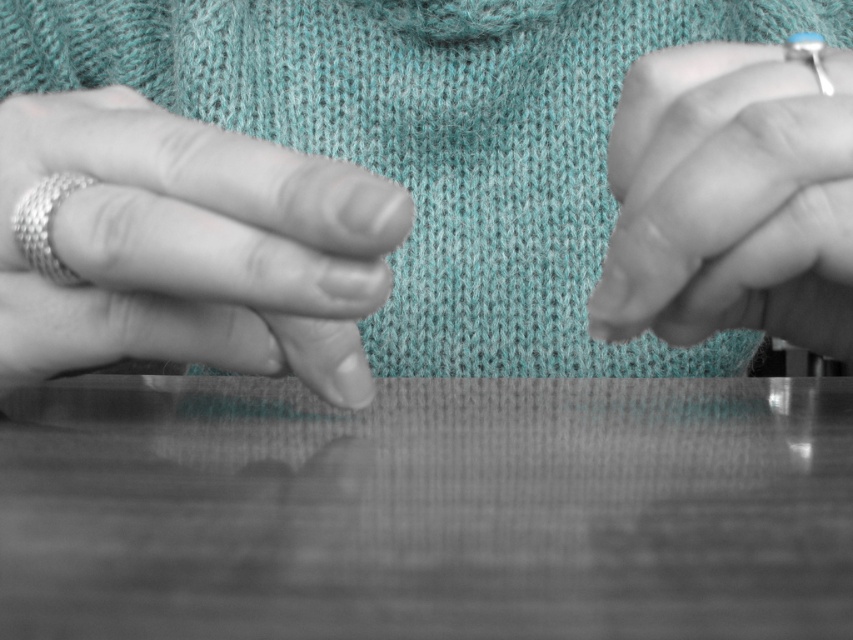
You are a jeweler examining two rings on a customer. The customer wants to know which ring is bigger. You see the metallic ring at left and the silver woven ring at left. Which one has a larger size?

The metallic ring at left has a larger size compared to the silver woven ring at left, so the metallic ring at left is bigger.

You are designing a ring display case and need to know the relative sizes of the rings. Which ring, the metallic ring at left or the silver metallic ring at upper right, is bigger?

The metallic ring at left is larger in size than the silver metallic ring at upper right.

You are a jeweler examining two rings on a customer. The customer wants to know which ring is taller. The rings are the metallic ring at left and the silver woven ring at left. Which one is taller?

The metallic ring at left is much taller than the silver woven ring at left according to the description.